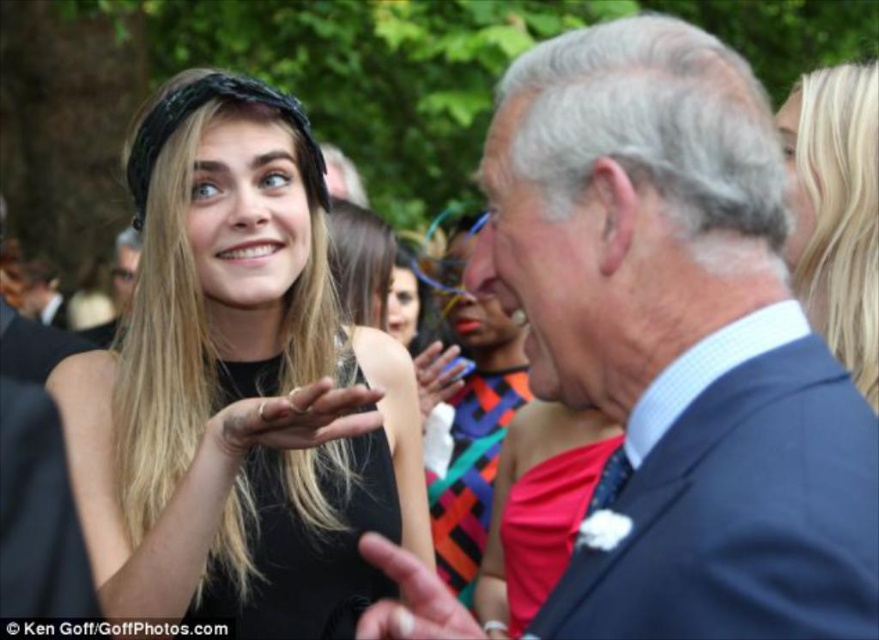
You are a photographer at an outdoor event. You want to capture a photo where the navy blue suit at center is clearly visible without being blocked by the multicolored fabric dress at center. Based on their positions, can you position yourself in a way to achieve this?

The navy blue suit at center is in front of the multicolored fabric dress at center, so positioning yourself behind the navy blue suit at center would allow it to be visible while the multicolored fabric dress at center is behind it and not blocking the view.